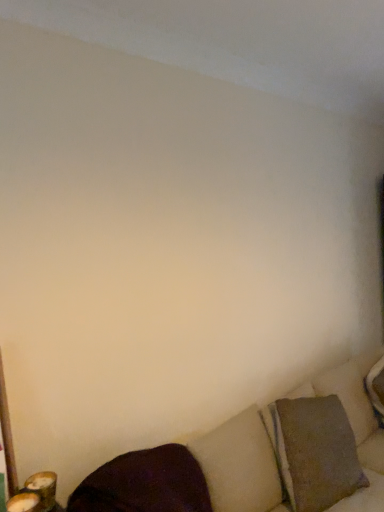
Question: Considering the relative sizes of textured brown pillow at lower right, which is counted as the first pillow, starting from the back, and textured beige couch at lower right in the image provided, is textured brown pillow at lower right, which is counted as the first pillow, starting from the back, smaller than textured beige couch at lower right?

Choices:
 (A) no
 (B) yes

Answer: (B)

Question: Does textured brown pillow at lower right, positioned as the second pillow in left-to-right order, turn towards textured beige couch at lower right?

Choices:
 (A) yes
 (B) no

Answer: (B)

Question: From a real-world perspective, is textured brown pillow at lower right, positioned as the second pillow in left-to-right order, positioned over textured beige couch at lower right based on gravity?

Choices:
 (A) no
 (B) yes

Answer: (A)

Question: Is textured brown pillow at lower right, the second pillow in the front-to-back sequence, outside of textured beige couch at lower right?

Choices:
 (A) no
 (B) yes

Answer: (B)

Question: Does textured brown pillow at lower right, which is counted as the first pillow, starting from the back, have a larger size compared to textured beige couch at lower right?

Choices:
 (A) no
 (B) yes

Answer: (A)

Question: Does point (326, 410) appear closer or farther from the camera than point (142, 459)?

Choices:
 (A) closer
 (B) farther

Answer: (B)

Question: Is textured brown pillow at lower right, which is counted as the first pillow, starting from the back, in front of or behind dark matte pillow at lower left, which is the 1th pillow in front-to-back order, in the image?

Choices:
 (A) front
 (B) behind

Answer: (B)

Question: In terms of width, does textured brown pillow at lower right, the second pillow in the front-to-back sequence, look wider or thinner when compared to dark matte pillow at lower left, which is the 1th pillow in front-to-back order?

Choices:
 (A) wide
 (B) thin

Answer: (A)

Question: Based on their positions, is textured brown pillow at lower right, the second pillow in the front-to-back sequence, located to the left or right of dark matte pillow at lower left, marked as the 1th pillow in a left-to-right arrangement?

Choices:
 (A) right
 (B) left

Answer: (A)

Question: Looking at their shapes, would you say textured beige couch at lower right is wider or thinner than dark matte pillow at lower left, which is the 1th pillow in front-to-back order?

Choices:
 (A) wide
 (B) thin

Answer: (A)

Question: From a real-world perspective, is textured beige couch at lower right above or below dark matte pillow at lower left, which ranks as the second pillow in back-to-front order?

Choices:
 (A) below
 (B) above

Answer: (A)

Question: Looking at the image, does textured beige couch at lower right seem bigger or smaller compared to dark matte pillow at lower left, marked as the 1th pillow in a left-to-right arrangement?

Choices:
 (A) big
 (B) small

Answer: (A)

Question: From their relative heights in the image, would you say textured beige couch at lower right is taller or shorter than dark matte pillow at lower left, marked as the 1th pillow in a left-to-right arrangement?

Choices:
 (A) short
 (B) tall

Answer: (B)

Question: Is point (365, 414) closer or farther from the camera than point (316, 412)?

Choices:
 (A) closer
 (B) farther

Answer: (B)

Question: From the image's perspective, is textured beige couch at lower right positioned above or below textured brown pillow at lower right, which is counted as the first pillow, starting from the back?

Choices:
 (A) below
 (B) above

Answer: (A)